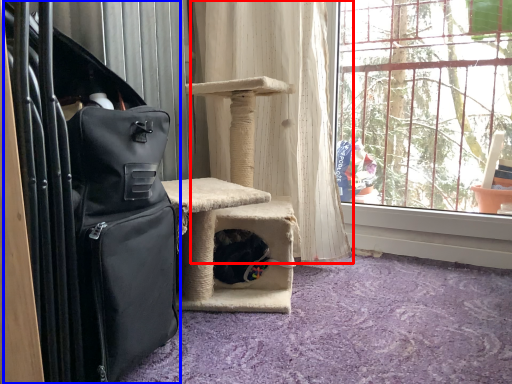
Question: Which object appears farthest to the camera in this image, curtain (highlighted by a red box) or luggage (highlighted by a blue box)?

Choices:
 (A) curtain
 (B) luggage

Answer: (A)